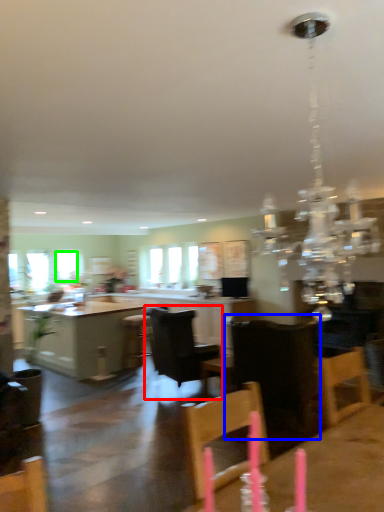
Question: Which is nearer to the chair (highlighted by a red box)? chair (highlighted by a blue box) or window (highlighted by a green box).

Choices:
 (A) chair
 (B) window

Answer: (A)